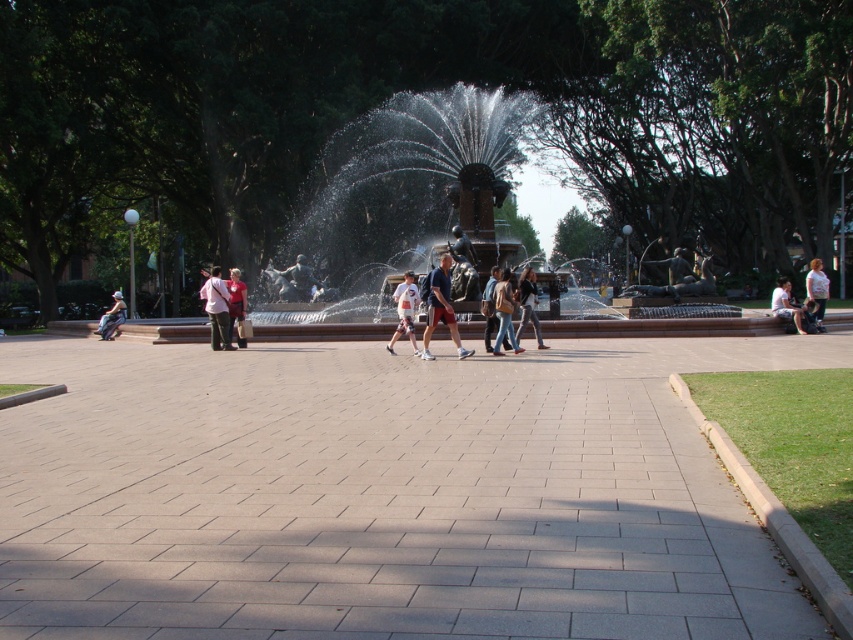
Question: Estimate the real-world distances between objects in this image. Which object is farther from the gray concrete pavement at center?

Choices:
 (A) denim jacket at center
 (B) matte red shirt at center
 (C) matte blue shorts at center
 (D) jeans at center

Answer: (B)

Question: Is jeans at center to the left of light blue denim jeans at lower right from the viewer's perspective?

Choices:
 (A) yes
 (B) no

Answer: (A)

Question: Does matte black backpack at center appear on the right side of denim jacket at center?

Choices:
 (A) no
 (B) yes

Answer: (A)

Question: Considering the real-world distances, which object is farthest from the matte blue shorts at center?

Choices:
 (A) denim jacket at center
 (B) matte red shirt at center

Answer: (B)

Question: Which is nearer to the matte blue shorts at center?

Choices:
 (A) light blue denim jeans at left
 (B) light brown leather jacket at right
 (C) light blue denim jeans at lower right
 (D) gray concrete pavement at center

Answer: (D)

Question: Does white cotton shirt at center have a larger size compared to light brown leather jacket at right?

Choices:
 (A) no
 (B) yes

Answer: (A)